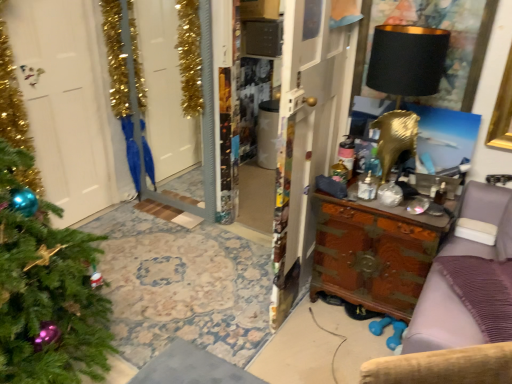
You are a GUI agent. You are given a task and a screenshot of the screen. Output one action in this format:
    pyautogui.click(x=<x>, y=<y>)
    Task: Click on the wooden chest of drawers at right
    The width and height of the screenshot is (512, 384).
    Given the screenshot: What is the action you would take?
    pyautogui.click(x=442, y=344)

Locate an element on the screen. gold metallic screen door at upper left is located at coordinates (140, 92).

Where is `wooden chest of drawers at right`? wooden chest of drawers at right is located at coordinates (442, 344).

Considering the relative positions of black fabric picture frame at upper right and black matte lampshade at upper right in the image provided, is black fabric picture frame at upper right to the right of black matte lampshade at upper right from the viewer's perspective?

Yes, black fabric picture frame at upper right is to the right of black matte lampshade at upper right.

From the image's perspective, is black fabric picture frame at upper right located above black matte lampshade at upper right?

Yes.

Are black fabric picture frame at upper right and black matte lampshade at upper right located far from each other?

black fabric picture frame at upper right is near black matte lampshade at upper right, not far away.

Which object is thinner, wooden chest of drawers at right or black fabric picture frame at upper right?

Thinner between the two is black fabric picture frame at upper right.

Is wooden chest of drawers at right oriented away from black fabric picture frame at upper right?

Yes, wooden chest of drawers at right is facing away from black fabric picture frame at upper right.

What's the angular difference between wooden chest of drawers at right and black fabric picture frame at upper right's facing directions?

The facing directions of wooden chest of drawers at right and black fabric picture frame at upper right are 44.9 degrees apart.

From the picture: Between wooden chest of drawers at right and black fabric picture frame at upper right, which one appears on the left side from the viewer's perspective?

black fabric picture frame at upper right is more to the left.

Considering the sizes of objects wooden chest at center and gold metallic screen door at upper left in the image provided, who is shorter, wooden chest at center or gold metallic screen door at upper left?

With less height is gold metallic screen door at upper left.

Is wooden chest at center touching gold metallic screen door at upper left?

wooden chest at center and gold metallic screen door at upper left are clearly separated.

Which is behind, point (298, 183) or point (120, 82)?

The point (120, 82) is more distant.

From the image's perspective, which one is positioned lower, wooden chest at center or gold metallic screen door at upper left?

wooden chest at center is shown below in the image.

From a real-world perspective, between wooden chest at center and black matte lampshade at upper right, who is vertically higher?

black matte lampshade at upper right is physically above.

Is wooden chest at center oriented away from black matte lampshade at upper right?

Yes, wooden chest at center is facing away from black matte lampshade at upper right.

Is wooden chest at center wider or thinner than black matte lampshade at upper right?

In the image, wooden chest at center appears to be more narrow than black matte lampshade at upper right.

Looking at this image, are wooden chest at center and black matte lampshade at upper right located far from each other?

wooden chest at center is near black matte lampshade at upper right, not far away.

Is black fabric picture frame at upper right oriented away from green matte christmas tree at left?

No, black fabric picture frame at upper right is not facing the opposite direction of green matte christmas tree at left.

Is black fabric picture frame at upper right to the left of green matte christmas tree at left from the viewer's perspective?

Incorrect, black fabric picture frame at upper right is not on the left side of green matte christmas tree at left.

Based on the photo, from a real-world perspective, is black fabric picture frame at upper right under green matte christmas tree at left?

No.

Which of these two, black fabric picture frame at upper right or green matte christmas tree at left, stands taller?

With more height is green matte christmas tree at left.

Does wooden chest at right turn towards wooden chest of drawers at right?

No, wooden chest at right is not oriented towards wooden chest of drawers at right.

Do you think wooden chest at right is within wooden chest of drawers at right, or outside of it?

wooden chest at right is located beyond the bounds of wooden chest of drawers at right.

Can you confirm if wooden chest at right is taller than wooden chest of drawers at right?

Incorrect, the height of wooden chest at right is not larger of that of wooden chest of drawers at right.

Which object is closer to the camera, wooden chest at right or wooden chest of drawers at right?

wooden chest of drawers at right is more forward.

Is wooden chest at right spatially inside black matte lampshade at upper right, or outside of it?

wooden chest at right is outside black matte lampshade at upper right.

Would you consider wooden chest at right to be distant from black matte lampshade at upper right?

No, wooden chest at right is not far from black matte lampshade at upper right.

What are the coordinates of `table behind the black matte lampshade at upper right` in the screenshot? It's located at (374, 253).

Does wooden chest at right turn towards black matte lampshade at upper right?

No, wooden chest at right is not aimed at black matte lampshade at upper right.

Where is `lamp that appears on the left of black fabric picture frame at upper right`? This screenshot has height=384, width=512. lamp that appears on the left of black fabric picture frame at upper right is located at coordinates (407, 60).

Locate an element on the screen. furniture that is under the black fabric picture frame at upper right (from a real-world perspective) is located at coordinates (442, 344).

When comparing their distances from wooden chest of drawers at right, does black fabric picture frame at upper right or wooden chest at right seem closer?

wooden chest at right is positioned closer to the anchor wooden chest of drawers at right.

In the scene shown: When comparing their distances from wooden chest of drawers at right, does black matte lampshade at upper right or green matte christmas tree at left seem further?

Among the two, green matte christmas tree at left is located further to wooden chest of drawers at right.

From the image, which object appears to be farther from gold metallic screen door at upper left, black fabric picture frame at upper right or wooden chest at center?

black fabric picture frame at upper right lies further to gold metallic screen door at upper left than the other object.

When comparing their distances from black fabric picture frame at upper right, does wooden chest of drawers at right or green matte christmas tree at left seem closer?

wooden chest of drawers at right.

Which object lies nearer to the anchor point wooden chest at center, wooden chest of drawers at right or black matte lampshade at upper right?

black matte lampshade at upper right is closer to wooden chest at center.

Looking at the image, which one is located further to wooden chest at right, black fabric picture frame at upper right or wooden chest of drawers at right?

The object further to wooden chest at right is black fabric picture frame at upper right.

Looking at the image, which one is located closer to wooden chest of drawers at right, gold metallic screen door at upper left or wooden chest at right?

wooden chest at right.

Based on their spatial positions, is wooden chest at right or wooden chest at center further from black fabric picture frame at upper right?

wooden chest at right.

Identify the location of armoire located between green matte christmas tree at left and black matte lampshade at upper right in the left-right direction. This screenshot has height=384, width=512. (306, 134).

Where is `lamp between black fabric picture frame at upper right and wooden chest at right from top to bottom`? lamp between black fabric picture frame at upper right and wooden chest at right from top to bottom is located at coordinates (407, 60).

This screenshot has width=512, height=384. Find the location of `lamp between gold metallic screen door at upper left and black fabric picture frame at upper right from left to right`. lamp between gold metallic screen door at upper left and black fabric picture frame at upper right from left to right is located at coordinates (407, 60).

The height and width of the screenshot is (384, 512). Identify the location of screen door between green matte christmas tree at left and black fabric picture frame at upper right. (140, 92).